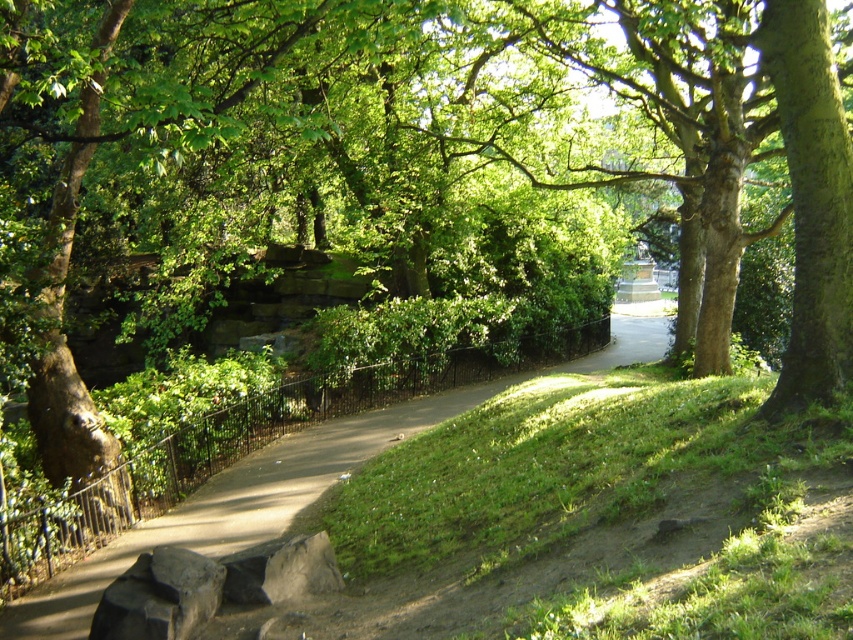
Question: Is smooth concrete path at center bigger than gray rough stone at lower center?

Choices:
 (A) no
 (B) yes

Answer: (B)

Question: Which point appears closest to the camera in this image?

Choices:
 (A) (317, 589)
 (B) (291, 502)

Answer: (A)

Question: Which object is closer to the camera taking this photo?

Choices:
 (A) gray rough stone at lower center
 (B) smooth concrete path at center

Answer: (A)

Question: From the image, what is the correct spatial relationship of smooth concrete path at center in relation to gray rough stone at lower center?

Choices:
 (A) left
 (B) right

Answer: (B)

Question: Does smooth concrete path at center have a smaller size compared to gray rough stone at lower center?

Choices:
 (A) yes
 (B) no

Answer: (B)